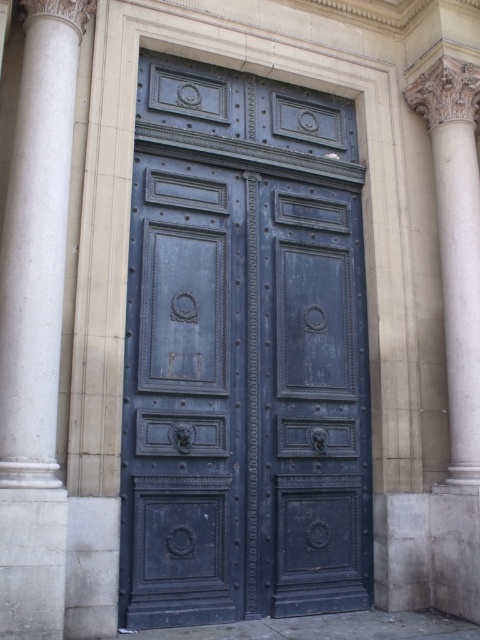
Question: Can you confirm if dark blue wood door at center is positioned to the left of white marble column at left?

Choices:
 (A) no
 (B) yes

Answer: (A)

Question: Is dark blue wood door at center bigger than white marble column at left?

Choices:
 (A) yes
 (B) no

Answer: (A)

Question: Is dark blue wood door at center to the left of white marble column at left from the viewer's perspective?

Choices:
 (A) yes
 (B) no

Answer: (B)

Question: Which of the following is the farthest from the observer?

Choices:
 (A) (12, 269)
 (B) (297, 586)

Answer: (B)

Question: Which object is farther from the camera taking this photo?

Choices:
 (A) white marble column at left
 (B) dark blue wood door at center

Answer: (B)